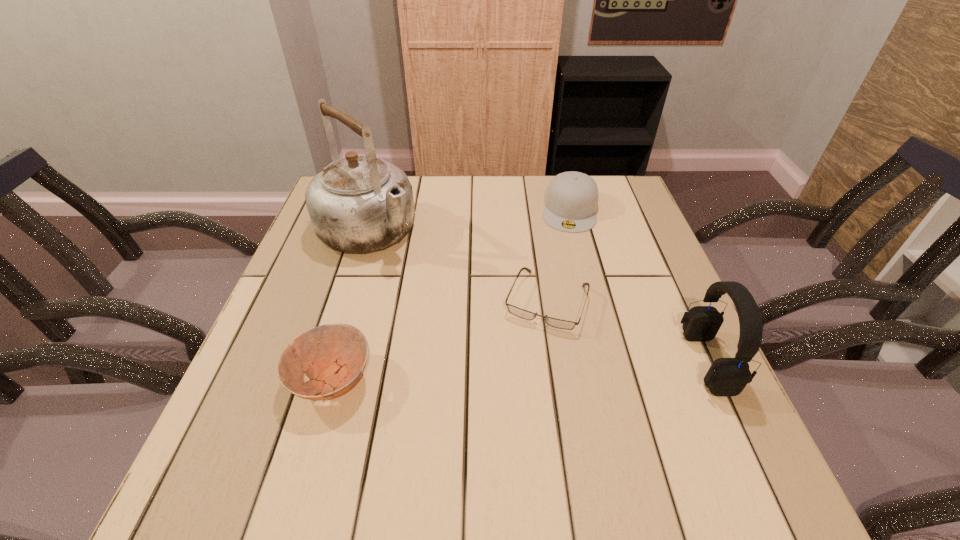
Where is `free space on the desktop that is between the fourth tallest object and the rightmost object and is positioned on the front-facing side of the third tallest object`? This screenshot has height=540, width=960. free space on the desktop that is between the fourth tallest object and the rightmost object and is positioned on the front-facing side of the third tallest object is located at coordinates (551, 369).

You are a GUI agent. You are given a task and a screenshot of the screen. Output one action in this format:
    pyautogui.click(x=<x>, y=<y>)
    Task: Click on the free space on the desktop that is between the second shortest object and the headset and is positioned at the spout of the kettle
    
    Given the screenshot: What is the action you would take?
    pyautogui.click(x=537, y=369)

Locate an element on the screen. vacant space on the desktop that is between the bowl and the headset and is positioned on the front-facing side of the spectacles is located at coordinates (519, 370).